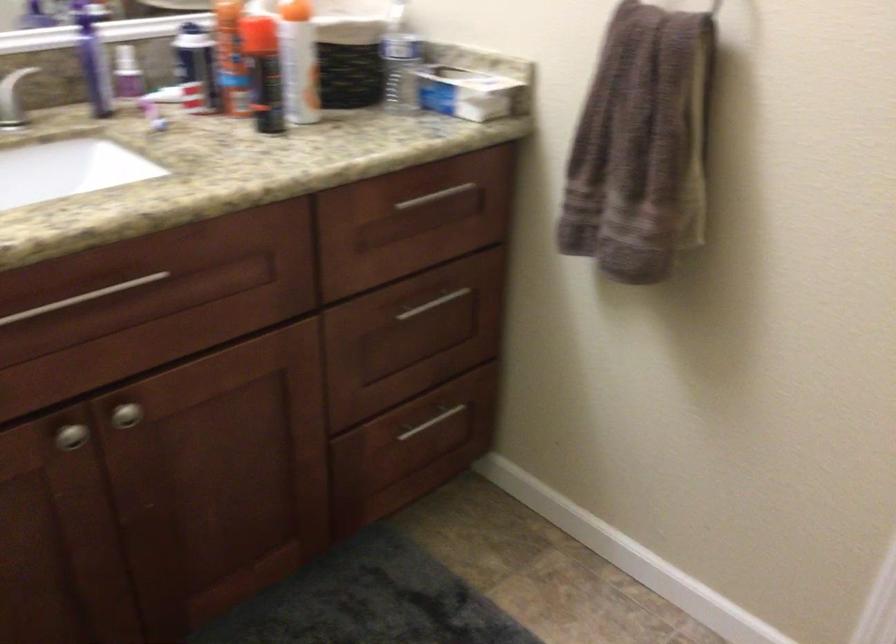
Where would you lift the faucet handle? Please return your answer as a coordinate pair (x, y).

(13, 97)